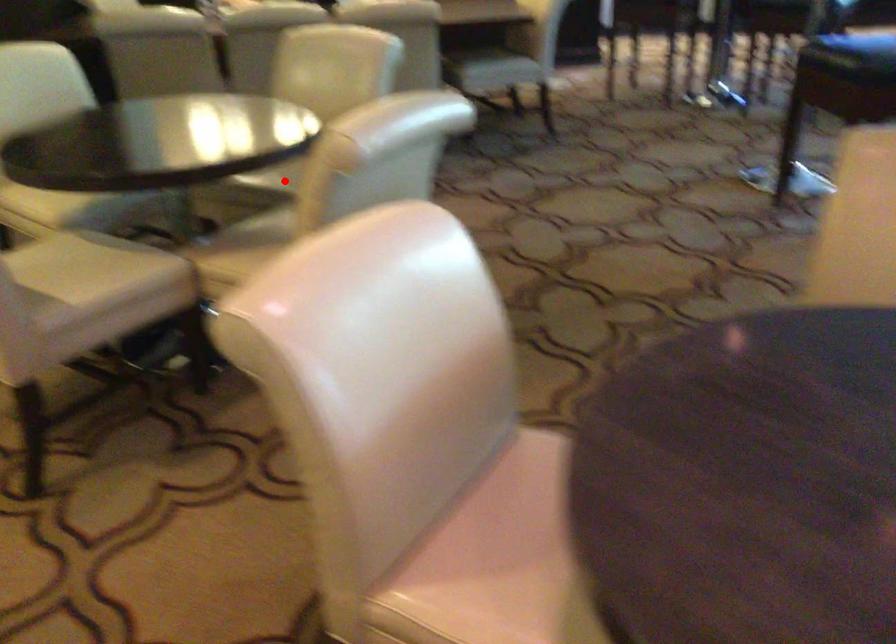
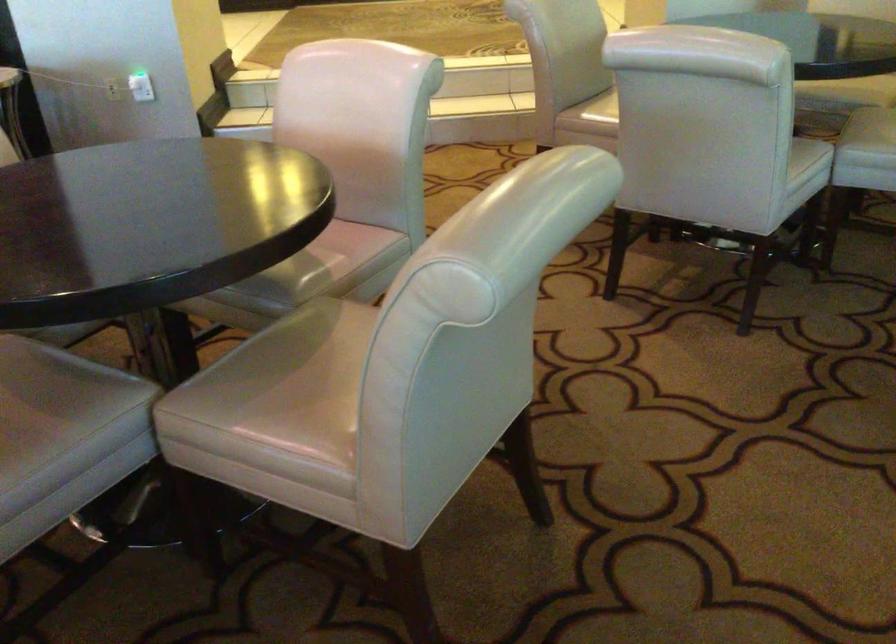
Find the pixel in the second image that matches the highlighted location in the first image.

(874, 125)